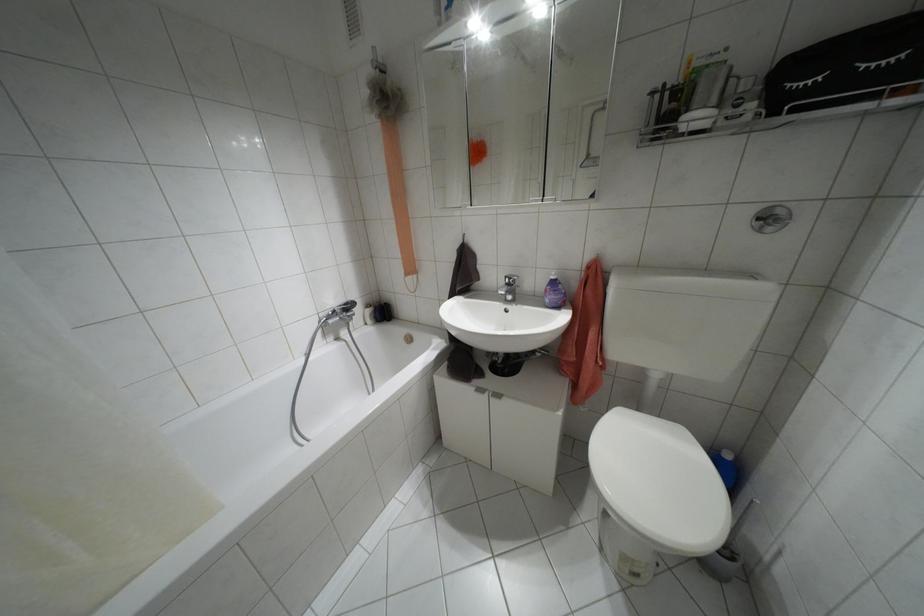
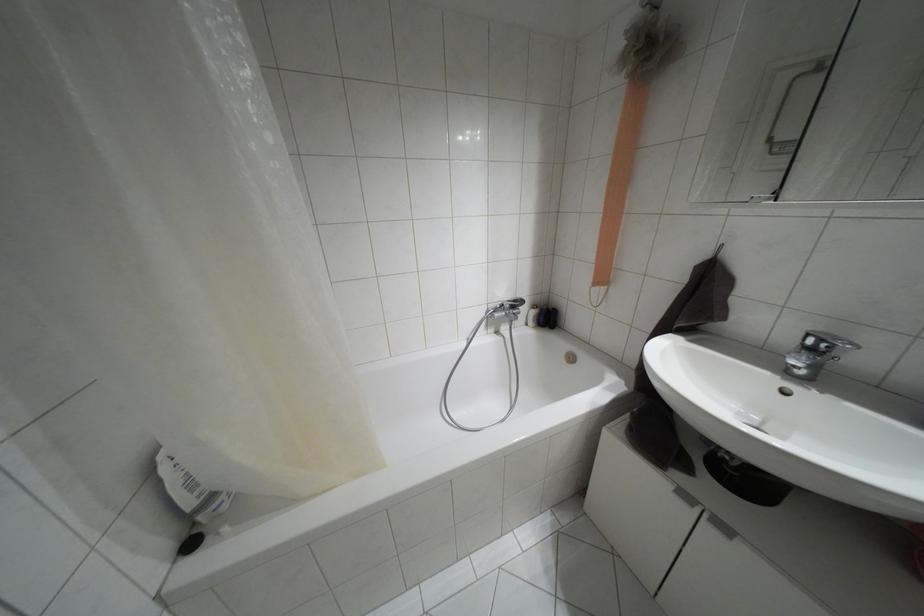
In the second image, find the point that corresponds to point 480,390 in the first image.

(685, 496)